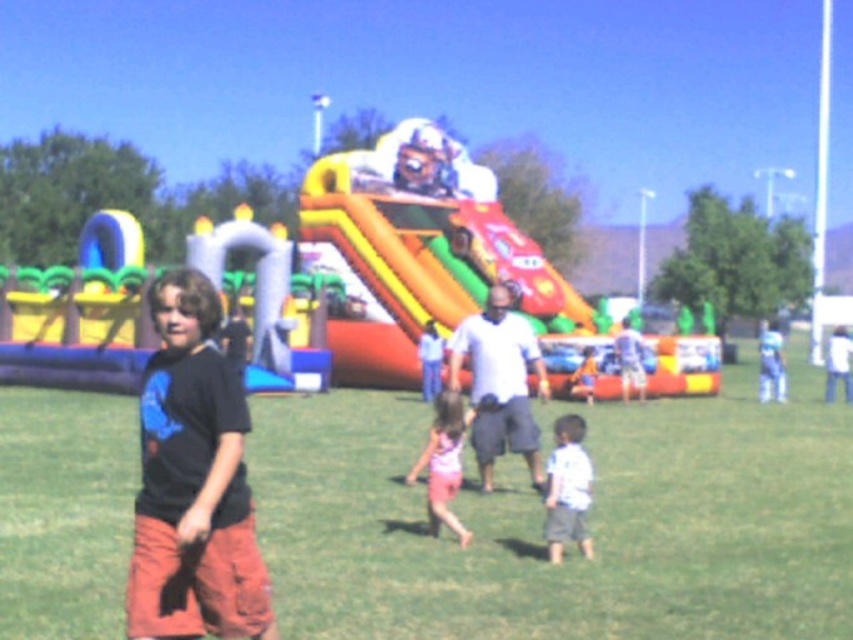
Question: In this image, where is green grass at center located relative to white matte shirt at center?

Choices:
 (A) above
 (B) below

Answer: (A)

Question: Among these objects, which one is farthest from the camera?

Choices:
 (A) green grass at center
 (B) white cotton shirt at center
 (C) pink fabric dress at center
 (D) white matte shirt at center

Answer: (D)

Question: Is multicolored inflatable slide at center positioned behind white matte shirt at center?

Choices:
 (A) no
 (B) yes

Answer: (B)

Question: Where is black cotton t-shirt at left located in relation to white matte shirt at center in the image?

Choices:
 (A) above
 (B) below

Answer: (B)

Question: Which of the following is the farthest from the observer?

Choices:
 (A) pyautogui.click(x=570, y=456)
 (B) pyautogui.click(x=352, y=216)
 (C) pyautogui.click(x=196, y=529)
 (D) pyautogui.click(x=473, y=326)

Answer: (B)

Question: Which point is closer to the camera taking this photo?

Choices:
 (A) (569, 436)
 (B) (189, 506)
 (C) (705, 429)
 (D) (340, 381)

Answer: (B)